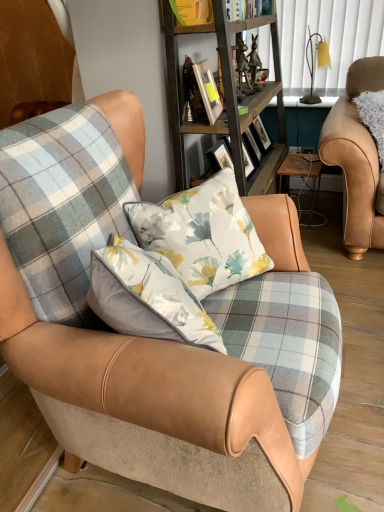
Question: Is wooden table at center inside or outside of leather armchair at right, placed as the second chair when sorted from front to back?

Choices:
 (A) outside
 (B) inside

Answer: (A)

Question: Is wooden table at center taller or shorter than leather armchair at right, placed as the first chair when sorted from back to front?

Choices:
 (A) tall
 (B) short

Answer: (B)

Question: Which object is the farthest from the plaid fabric chair at center, which is the first chair in left-to-right order?

Choices:
 (A) wooden shelf at center
 (B) metallic silver picture frame at upper center
 (C) hardcover book at upper center
 (D) leather armchair at right, which ranks as the first chair in right-to-left order
 (E) wooden table at center

Answer: (C)

Question: Estimate the real-world distances between objects in this image. Which object is farther from the plaid fabric chair at center, which is the first chair in left-to-right order?

Choices:
 (A) wooden shelf at center
 (B) matte yellow lampshade at upper right
 (C) wooden table at center
 (D) metallic silver picture frame at upper center
 (E) leather armchair at right, placed as the second chair when sorted from front to back

Answer: (B)